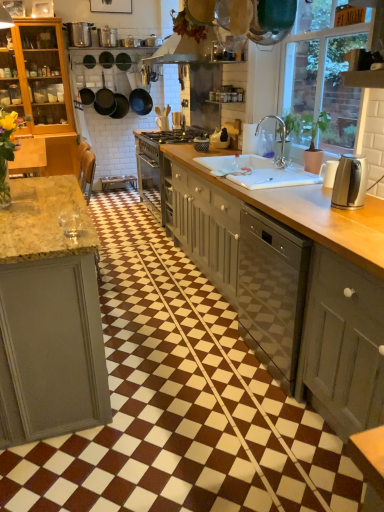
At what (x,y) coordinates should I click in order to perform the action: click on free space to the left of matte gray cabinet at lower right. Please return your answer as a coordinate pair (x, y). This screenshot has width=384, height=512. Looking at the image, I should click on (272, 436).